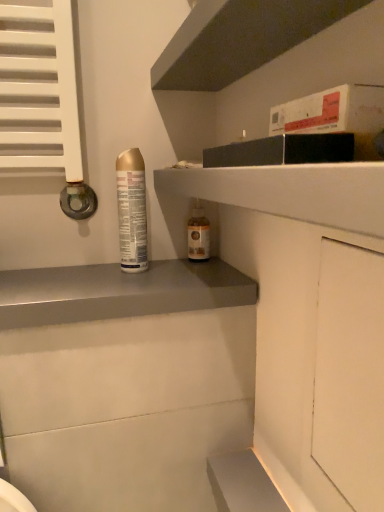
Identify the location of smooth gray shelf at center, placed as the first shelf when sorted from bottom to top. The height and width of the screenshot is (512, 384). (119, 292).

What do you see at coordinates (350, 373) in the screenshot? I see `white matte cabinet at right` at bounding box center [350, 373].

This screenshot has height=512, width=384. Describe the element at coordinates (240, 39) in the screenshot. I see `dark gray matte shelf at upper center, the 1th shelf positioned from the top` at that location.

Locate an element on the screen. dark gray matte shelf at upper center, the 1th shelf positioned from the top is located at coordinates (x=240, y=39).

This screenshot has height=512, width=384. Describe the element at coordinates (198, 234) in the screenshot. I see `translucent glass bottle at center, the 1th bottle when ordered from back to front` at that location.

Find the location of a particular element. The height and width of the screenshot is (512, 384). smooth gray shelf at center, placed as the first shelf when sorted from bottom to top is located at coordinates (119, 292).

Could you tell me if translucent glass bottle at center, which is the first bottle from right to left, is turned towards white matte cabinet at right?

Yes, translucent glass bottle at center, which is the first bottle from right to left, is facing white matte cabinet at right.

Between translucent glass bottle at center, which is the second bottle from left to right, and white matte cabinet at right, which one appears on the left side from the viewer's perspective?

Positioned to the left is translucent glass bottle at center, which is the second bottle from left to right.

I want to click on bottle that is the 2nd one when counting backward from the white matte cabinet at right, so click(x=198, y=234).

Is translucent glass bottle at center, which is the second bottle from left to right, bigger than white matte cabinet at right?

Incorrect, translucent glass bottle at center, which is the second bottle from left to right, is not larger than white matte cabinet at right.

What's the angular difference between gold metallic can at left, which ranks as the first bottle in front-to-back order, and matte black shelf at upper right, which ranks as the second shelf in bottom-to-top order,'s facing directions?

90 degrees separate the facing orientations of gold metallic can at left, which ranks as the first bottle in front-to-back order, and matte black shelf at upper right, which ranks as the second shelf in bottom-to-top order.

From the picture: Visually, is gold metallic can at left, which ranks as the first bottle in front-to-back order, positioned to the left or to the right of matte black shelf at upper right, which ranks as the second shelf in bottom-to-top order?

Based on their positions, gold metallic can at left, which ranks as the first bottle in front-to-back order, is located to the left of matte black shelf at upper right, which ranks as the second shelf in bottom-to-top order.

I want to click on the 1st shelf above the gold metallic can at left, the 1th bottle viewed from the left (from the image's perspective), so click(291, 191).

Are gold metallic can at left, positioned as the 2th bottle in right-to-left order, and matte black shelf at upper right, the 2th shelf viewed from the top, located far from each other?

No, gold metallic can at left, positioned as the 2th bottle in right-to-left order, is not far away from matte black shelf at upper right, the 2th shelf viewed from the top.

Looking at the image, does translucent glass bottle at center, placed as the second bottle when sorted from front to back, seem bigger or smaller compared to smooth gray shelf at center, which ranks as the 3th shelf in top-to-bottom order?

Clearly, translucent glass bottle at center, placed as the second bottle when sorted from front to back, is smaller in size than smooth gray shelf at center, which ranks as the 3th shelf in top-to-bottom order.

Based on their positions, is translucent glass bottle at center, placed as the second bottle when sorted from front to back, located to the left or right of smooth gray shelf at center, which ranks as the 3th shelf in top-to-bottom order?

translucent glass bottle at center, placed as the second bottle when sorted from front to back, is to the right of smooth gray shelf at center, which ranks as the 3th shelf in top-to-bottom order.

Does point (199, 203) come in front of point (232, 173)?

No, it is behind (232, 173).

Can you confirm if translucent glass bottle at center, placed as the second bottle when sorted from front to back, is positioned to the right of matte black shelf at upper right, which ranks as the second shelf in bottom-to-top order?

No, translucent glass bottle at center, placed as the second bottle when sorted from front to back, is not to the right of matte black shelf at upper right, which ranks as the second shelf in bottom-to-top order.

Is translucent glass bottle at center, which is the first bottle from right to left, aimed at matte black shelf at upper right, which ranks as the second shelf in bottom-to-top order?

No, translucent glass bottle at center, which is the first bottle from right to left, is not oriented towards matte black shelf at upper right, which ranks as the second shelf in bottom-to-top order.

From the image's perspective, relative to smooth gray shelf at center, placed as the first shelf when sorted from bottom to top, is gold metallic can at left, the 1th bottle viewed from the left, above or below?

Based on their image positions, gold metallic can at left, the 1th bottle viewed from the left, is located above smooth gray shelf at center, placed as the first shelf when sorted from bottom to top.

Between gold metallic can at left, positioned as the 2th bottle in right-to-left order, and smooth gray shelf at center, which ranks as the 3th shelf in top-to-bottom order, which one has more height?

With more height is gold metallic can at left, positioned as the 2th bottle in right-to-left order.

Can you tell me how much gold metallic can at left, which is the second bottle in back-to-front order, and smooth gray shelf at center, which ranks as the 3th shelf in top-to-bottom order, differ in facing direction?

The angle between the facing direction of gold metallic can at left, which is the second bottle in back-to-front order, and the facing direction of smooth gray shelf at center, which ranks as the 3th shelf in top-to-bottom order, is 1.61 degrees.

Looking at this image, is matte black shelf at upper right, which ranks as the second shelf in bottom-to-top order, further to the viewer compared to dark gray matte shelf at upper center, the 1th shelf positioned from the top?

No, the depth of matte black shelf at upper right, which ranks as the second shelf in bottom-to-top order, is less than that of dark gray matte shelf at upper center, the 1th shelf positioned from the top.

Who is bigger, matte black shelf at upper right, which ranks as the second shelf in bottom-to-top order, or dark gray matte shelf at upper center, the 1th shelf positioned from the top?

matte black shelf at upper right, which ranks as the second shelf in bottom-to-top order, is bigger.

From the image's perspective, which is below, matte black shelf at upper right, the 2th shelf viewed from the top, or dark gray matte shelf at upper center, positioned as the 3th shelf in bottom-to-top order?

matte black shelf at upper right, the 2th shelf viewed from the top, is shown below in the image.

From the picture: Is matte black shelf at upper right, which ranks as the second shelf in bottom-to-top order, taller than dark gray matte shelf at upper center, the 1th shelf positioned from the top?

Yes, matte black shelf at upper right, which ranks as the second shelf in bottom-to-top order, is taller than dark gray matte shelf at upper center, the 1th shelf positioned from the top.

In the image, is white matte cabinet at right positioned in front of or behind smooth gray shelf at center, which ranks as the 3th shelf in top-to-bottom order?

white matte cabinet at right is positioned closer to the viewer than smooth gray shelf at center, which ranks as the 3th shelf in top-to-bottom order.

Looking at this image, considering the sizes of objects white matte cabinet at right and smooth gray shelf at center, placed as the first shelf when sorted from bottom to top, in the image provided, who is shorter, white matte cabinet at right or smooth gray shelf at center, placed as the first shelf when sorted from bottom to top,?

smooth gray shelf at center, placed as the first shelf when sorted from bottom to top, is shorter.

Which of these two, white matte cabinet at right or smooth gray shelf at center, which ranks as the 3th shelf in top-to-bottom order, is wider?

With larger width is smooth gray shelf at center, which ranks as the 3th shelf in top-to-bottom order.

In the scene shown: From a real-world perspective, which is physically above, white matte cabinet at right or smooth gray shelf at center, placed as the first shelf when sorted from bottom to top?

In real-world perspective, smooth gray shelf at center, placed as the first shelf when sorted from bottom to top, is above.

There is a white matte cabinet at right. Identify the location of the 1st bottle above it (from the image's perspective). (198, 234).

Identify the location of the 2nd bottle to the left of the matte black shelf at upper right, which ranks as the second shelf in bottom-to-top order, starting your count from the anchor. Image resolution: width=384 pixels, height=512 pixels. (132, 210).

Estimate the real-world distances between objects in this image. Which object is closer to matte black shelf at upper right, the 2th shelf viewed from the top, smooth gray shelf at center, which ranks as the 3th shelf in top-to-bottom order, or translucent glass bottle at center, the 1th bottle when ordered from back to front?

smooth gray shelf at center, which ranks as the 3th shelf in top-to-bottom order, is closer to matte black shelf at upper right, the 2th shelf viewed from the top.

Considering their positions, is matte black shelf at upper right, which ranks as the second shelf in bottom-to-top order, positioned further to gold metallic can at left, which ranks as the first bottle in front-to-back order, than smooth gray shelf at center, which ranks as the 3th shelf in top-to-bottom order?

matte black shelf at upper right, which ranks as the second shelf in bottom-to-top order, is further to gold metallic can at left, which ranks as the first bottle in front-to-back order.

Which object lies nearer to the anchor point dark gray matte shelf at upper center, the 1th shelf positioned from the top, smooth gray shelf at center, which ranks as the 3th shelf in top-to-bottom order, or matte black shelf at upper right, the 2th shelf viewed from the top?

matte black shelf at upper right, the 2th shelf viewed from the top, is positioned closer to the anchor dark gray matte shelf at upper center, the 1th shelf positioned from the top.

Estimate the real-world distances between objects in this image. Which object is closer to gold metallic can at left, positioned as the 2th bottle in right-to-left order, smooth gray shelf at center, placed as the first shelf when sorted from bottom to top, or white matte cabinet at right?

smooth gray shelf at center, placed as the first shelf when sorted from bottom to top, lies closer to gold metallic can at left, positioned as the 2th bottle in right-to-left order, than the other object.

Considering their positions, is white matte cabinet at right positioned closer to gold metallic can at left, positioned as the 2th bottle in right-to-left order, than translucent glass bottle at center, which is the first bottle from right to left?

Based on the image, translucent glass bottle at center, which is the first bottle from right to left, appears to be nearer to gold metallic can at left, positioned as the 2th bottle in right-to-left order.

When comparing their distances from translucent glass bottle at center, the 1th bottle when ordered from back to front, does dark gray matte shelf at upper center, the 1th shelf positioned from the top, or smooth gray shelf at center, which ranks as the 3th shelf in top-to-bottom order, seem closer?

smooth gray shelf at center, which ranks as the 3th shelf in top-to-bottom order.

From the image, which object appears to be farther from dark gray matte shelf at upper center, the 1th shelf positioned from the top, gold metallic can at left, the 1th bottle viewed from the left, or white matte cabinet at right?

white matte cabinet at right is further to dark gray matte shelf at upper center, the 1th shelf positioned from the top.

Estimate the real-world distances between objects in this image. Which object is closer to white matte cabinet at right, translucent glass bottle at center, placed as the second bottle when sorted from front to back, or dark gray matte shelf at upper center, positioned as the 3th shelf in bottom-to-top order?

dark gray matte shelf at upper center, positioned as the 3th shelf in bottom-to-top order.

What are the coordinates of `shelf positioned between dark gray matte shelf at upper center, the 1th shelf positioned from the top, and gold metallic can at left, the 1th bottle viewed from the left, from near to far` in the screenshot? It's located at (119, 292).

You are a GUI agent. You are given a task and a screenshot of the screen. Output one action in this format:
    pyautogui.click(x=<x>, y=<y>)
    Task: Click on the bottle located between matte black shelf at upper right, which ranks as the second shelf in bottom-to-top order, and translucent glass bottle at center, which is the first bottle from right to left, in the depth direction
    
    Given the screenshot: What is the action you would take?
    pyautogui.click(x=132, y=210)

Where is `bottle located between white matte cabinet at right and translucent glass bottle at center, placed as the second bottle when sorted from front to back, in the depth direction`? bottle located between white matte cabinet at right and translucent glass bottle at center, placed as the second bottle when sorted from front to back, in the depth direction is located at coordinates (132, 210).

Find the location of `shelf between matte black shelf at upper right, which ranks as the second shelf in bottom-to-top order, and smooth gray shelf at center, which ranks as the 3th shelf in top-to-bottom order, in the front-back direction`. shelf between matte black shelf at upper right, which ranks as the second shelf in bottom-to-top order, and smooth gray shelf at center, which ranks as the 3th shelf in top-to-bottom order, in the front-back direction is located at coordinates pyautogui.click(x=240, y=39).